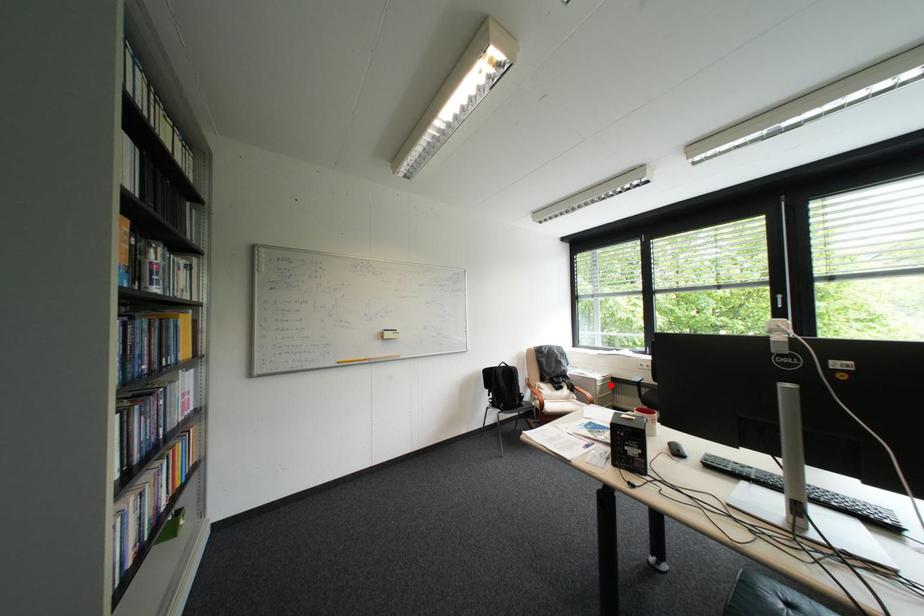
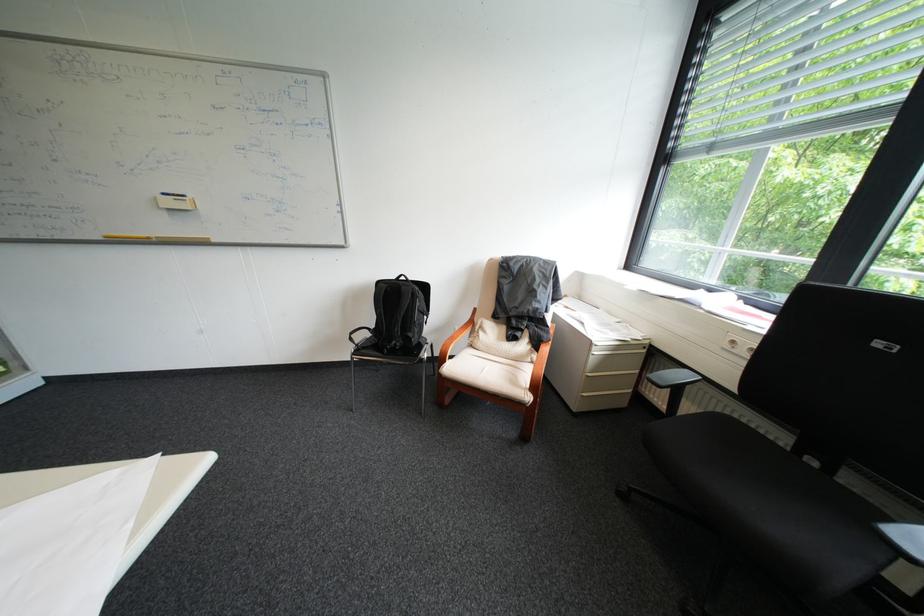
Question: I am providing you with two images of the same scene from different viewpoints. Given a red point in image1, look at the same physical point in image2. Is it:

Choices:
 (A) Closer to the viewpoint
 (B) Farther from the viewpoint

Answer: (A)